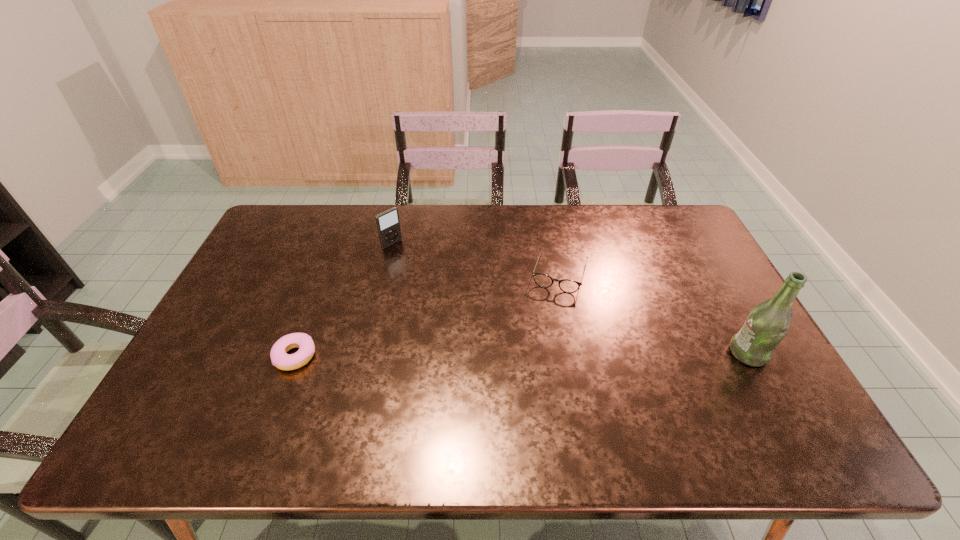
Locate an element on the screen. Image resolution: width=960 pixels, height=540 pixels. free space that satisfies the following two spatial constraints: 1. on the back side of the farthest object; 2. on the left side of the leftmost object is located at coordinates (338, 244).